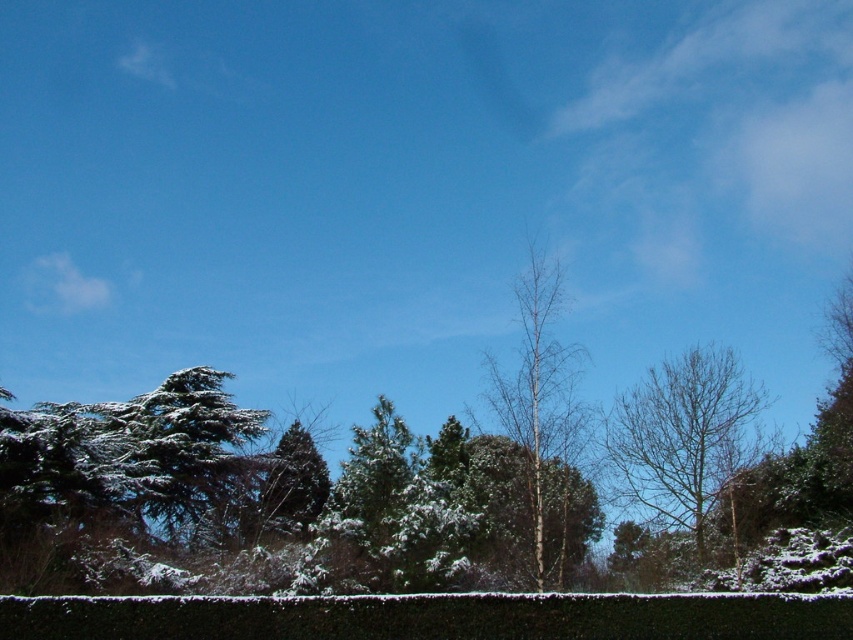
You are standing in the winter landscape and want to place a small birdhouse between the bare branches tree at center and the bare wood tree at center. Based on their positions, which tree should the birdhouse be placed closer to?

The birdhouse should be placed closer to the bare branches tree at center because it is positioned under the bare wood tree at center, meaning the branches tree is lower in height.

You are a bird looking for a place to land in the winter scene. You see both the bare branches tree at center and the bare wood tree at center. Which tree is farther away from you?

The bare wood tree at center is farther away because it is positioned behind the bare branches tree at center.

You are a delivery drone with a wingspan of 1.5 meters. You need to fly through the gap between the bare branches tree at center and the bare wood tree at center. Can you safely pass through the gap without touching either tree?

The distance between the bare branches tree at center and the bare wood tree at center is 7.95 meters. Since your wingspan is 1.5 meters, there is more than enough space to safely pass through the gap without touching either tree.